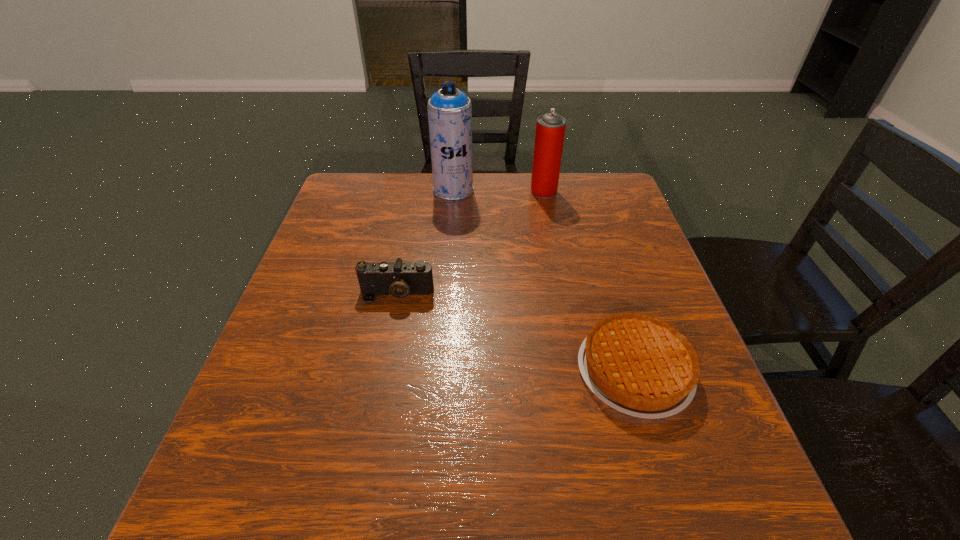
Find the location of a particular element. empty space that is in between the pie and the left aerosol can is located at coordinates (544, 280).

Find the location of a particular element. This screenshot has width=960, height=540. free point between the nearest object and the camera is located at coordinates (516, 332).

The height and width of the screenshot is (540, 960). Identify the location of empty location between the shortest object and the left aerosol can. (544, 280).

The height and width of the screenshot is (540, 960). Find the location of `vacant area between the third farthest object and the tallest object`. vacant area between the third farthest object and the tallest object is located at coordinates (425, 242).

Image resolution: width=960 pixels, height=540 pixels. In order to click on vacant space that's between the camera and the right aerosol can in this screenshot , I will do `click(470, 242)`.

You are a GUI agent. You are given a task and a screenshot of the screen. Output one action in this format:
    pyautogui.click(x=<x>, y=<y>)
    Task: Click on the free space between the third tallest object and the pie
    Image resolution: width=960 pixels, height=540 pixels.
    Given the screenshot: What is the action you would take?
    pyautogui.click(x=516, y=332)

Identify the location of free point between the third farthest object and the pie. The image size is (960, 540). (516, 332).

This screenshot has width=960, height=540. I want to click on unoccupied position between the shorter aerosol can and the tallest object, so click(x=498, y=191).

Locate an element on the screen. The image size is (960, 540). free space between the shortest object and the third shortest object is located at coordinates (589, 281).

Choose which object is the third nearest neighbor to the camera. Please provide its 2D coordinates. Your answer should be formatted as a tuple, i.e. [(x, y)], where the tuple contains the x and y coordinates of a point satisfying the conditions above.

[(550, 128)]